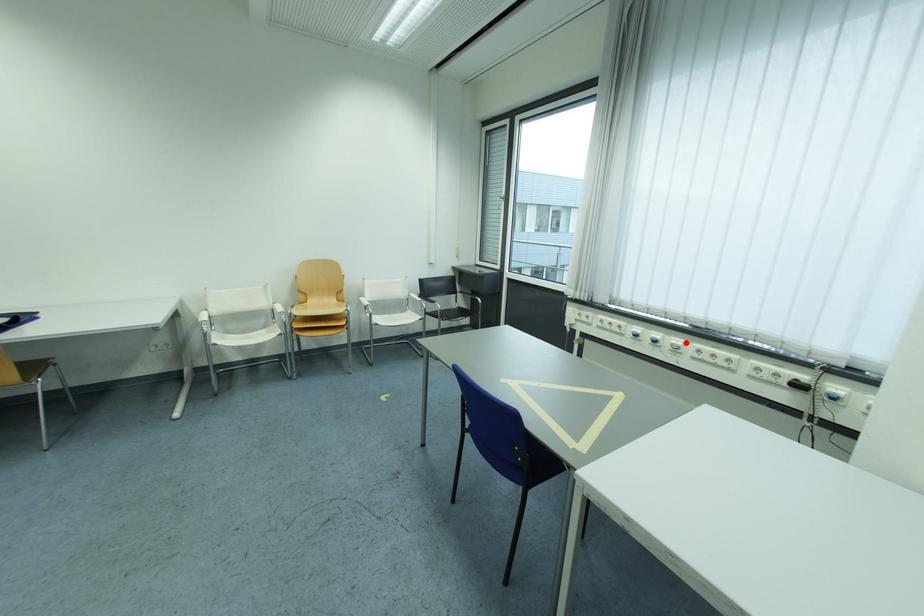
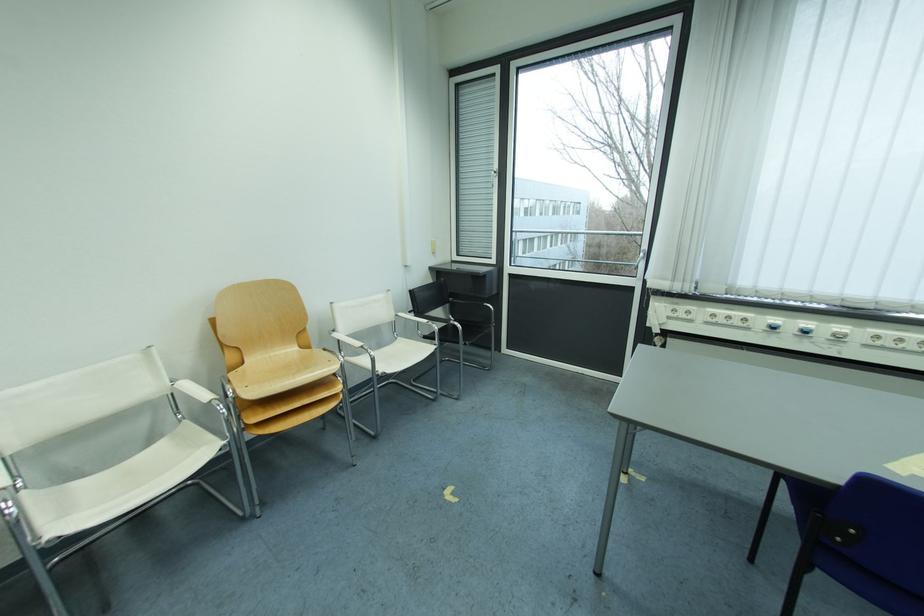
Where in the second image is the point corresponding to the highlighted location from the first image?

(849, 330)